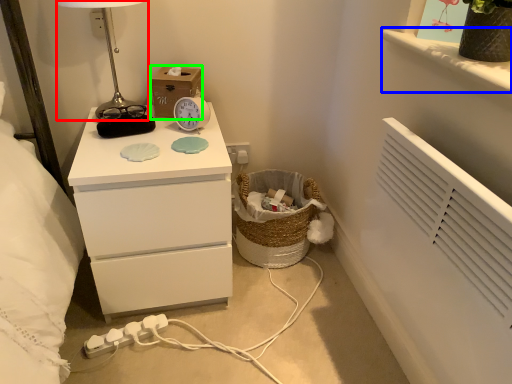
Question: Which object is positioned closest to table lamp (highlighted by a red box)? Select from window sill (highlighted by a blue box) and cardboard box (highlighted by a green box).

Choices:
 (A) window sill
 (B) cardboard box

Answer: (B)